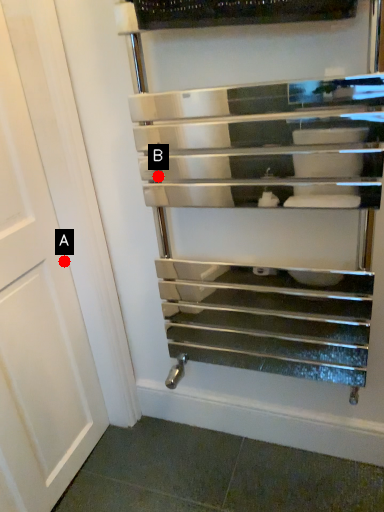
Question: Two points are circled on the image, labeled by A and B beside each circle. Which of the following is the closest to the observer?

Choices:
 (A) A is closer
 (B) B is closer

Answer: (A)